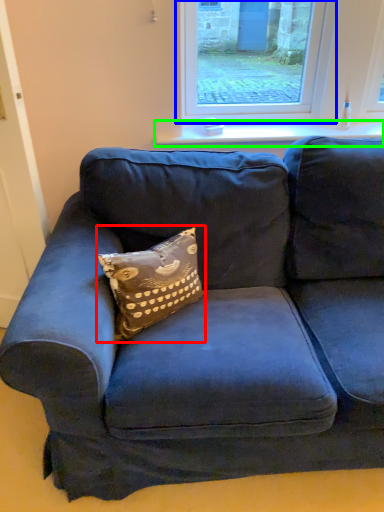
Question: Estimate the real-world distances between objects in this image. Which object is closer to pillow (highlighted by a red box), window (highlighted by a blue box) or window sill (highlighted by a green box)?

Choices:
 (A) window
 (B) window sill

Answer: (B)